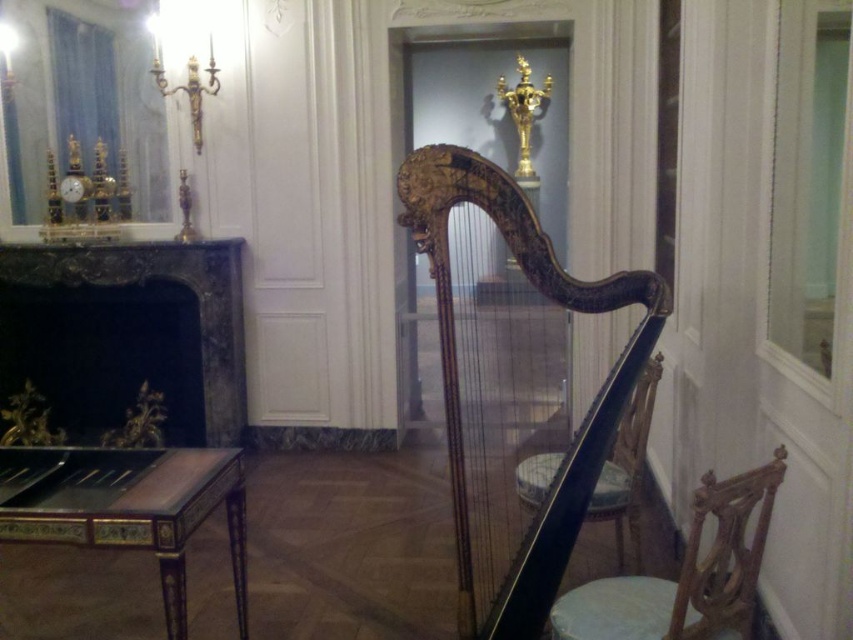
The image size is (853, 640). Find the location of `glossy wood harp at center`. glossy wood harp at center is located at coordinates (457, 376).

Who is lower down, glossy wood harp at center or black marble fireplace at left?

glossy wood harp at center is lower down.

Is point (575, 304) positioned before point (215, 264)?

Yes, point (575, 304) is in front of point (215, 264).

What are the coordinates of `glossy wood harp at center` in the screenshot? It's located at (457, 376).

Which is more to the left, wooden chair at center or smooth white stool at lower right?

From the viewer's perspective, smooth white stool at lower right appears more on the left side.

Is point (517, 464) positioned in front of point (599, 513)?

That is False.

This screenshot has height=640, width=853. Identify the location of wooden chair at center. (625, 467).

Is glossy wood harp at center to the left of wooden chair at lower right from the viewer's perspective?

Correct, you'll find glossy wood harp at center to the left of wooden chair at lower right.

Is point (611, 289) in front of point (691, 593)?

No, it is behind (691, 593).

Is point (489, 163) positioned behind point (704, 593)?

Yes, point (489, 163) is farther from viewer.

Identify the location of glossy wood harp at center. The height and width of the screenshot is (640, 853). (457, 376).